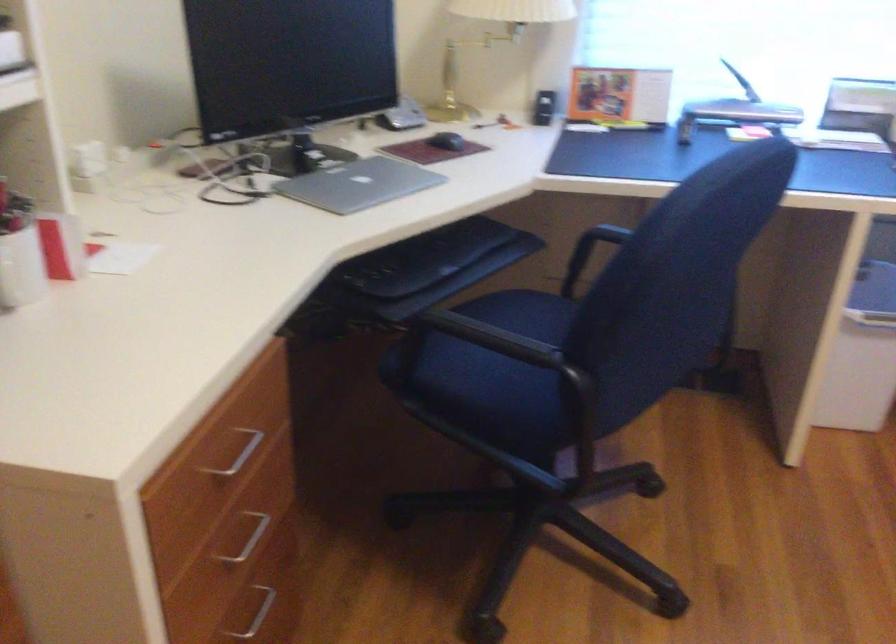
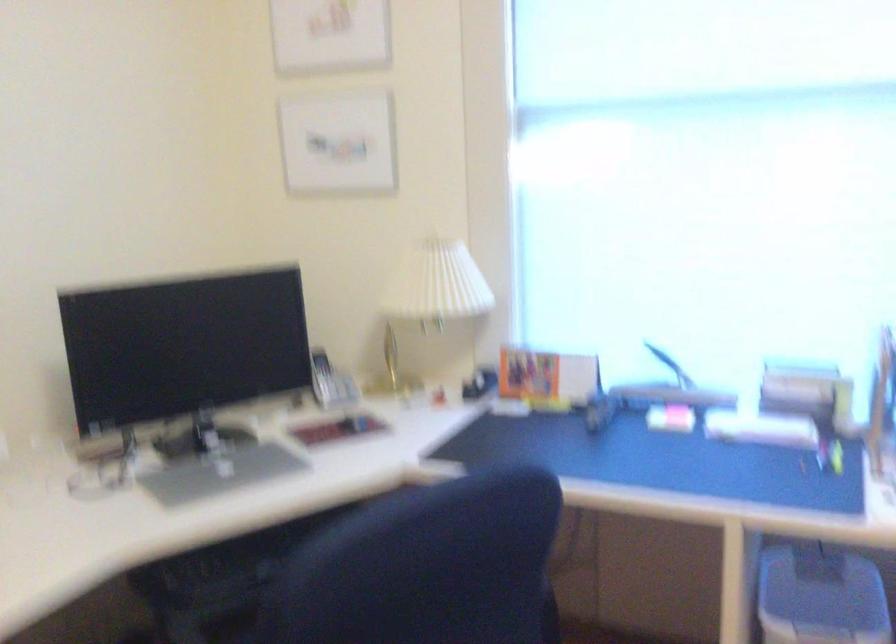
Question: In a continuous first-person perspective shot, in which direction is the camera moving?

Choices:
 (A) Left
 (B) Right
 (C) Forward
 (D) Backward

Answer: (B)